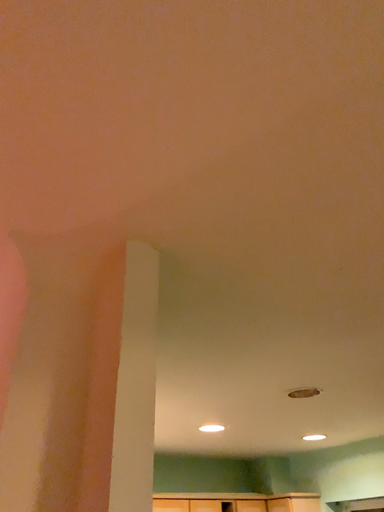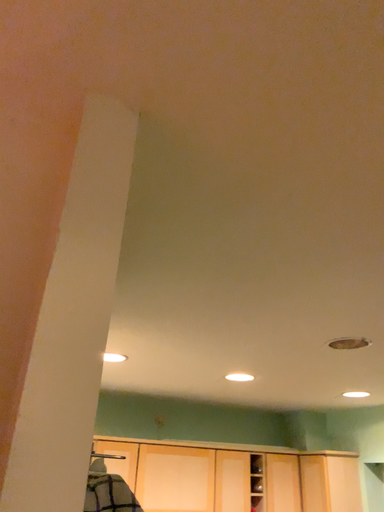
Question: Which way did the camera rotate in the video?

Choices:
 (A) rotated downward
 (B) rotated upward

Answer: (A)